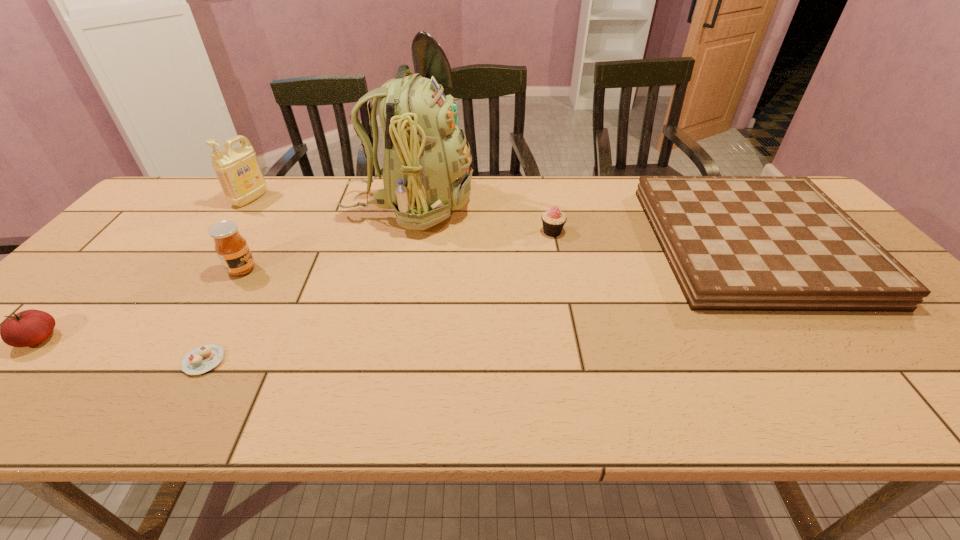
Where is `free space between the backpack and the second object from left to right`? The height and width of the screenshot is (540, 960). free space between the backpack and the second object from left to right is located at coordinates (329, 202).

Find the location of a particular element. The width and height of the screenshot is (960, 540). free space between the right cupcake and the gameboard is located at coordinates (652, 238).

You are a GUI agent. You are given a task and a screenshot of the screen. Output one action in this format:
    pyautogui.click(x=<x>, y=<y>)
    Task: Click on the vacant point located between the fifth shortest object and the right cupcake
    
    Given the screenshot: What is the action you would take?
    [397, 251]

Where is `free space between the rightmost object and the honey`? free space between the rightmost object and the honey is located at coordinates (497, 256).

What are the coordinates of `free space between the farther cupcake and the gameboard` in the screenshot? It's located at (652, 238).

Locate an element on the screen. vacant area that lies between the gameboard and the fifth shortest object is located at coordinates (497, 256).

Find the location of a particular element. The image size is (960, 540). free space between the second tallest object and the left cupcake is located at coordinates (227, 280).

Where is `vacant space in between the left cupcake and the tallest object`? vacant space in between the left cupcake and the tallest object is located at coordinates (306, 283).

This screenshot has width=960, height=540. I want to click on object that can be found as the second closest to the rightmost object, so click(x=426, y=174).

Image resolution: width=960 pixels, height=540 pixels. Find the location of `object that can be found as the sixth closest to the taller cupcake`. object that can be found as the sixth closest to the taller cupcake is located at coordinates (30, 327).